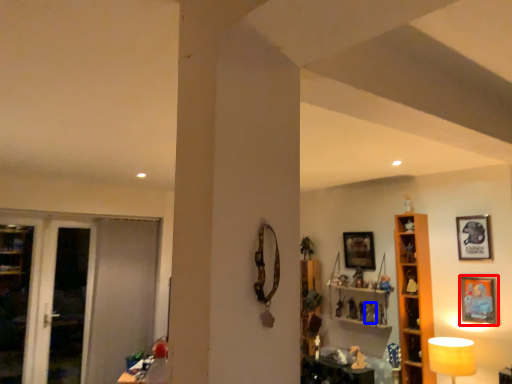
Question: Which point is closer to the camera, picture frame (highlighted by a red box) or toy (highlighted by a blue box)?

Choices:
 (A) picture frame
 (B) toy

Answer: (A)